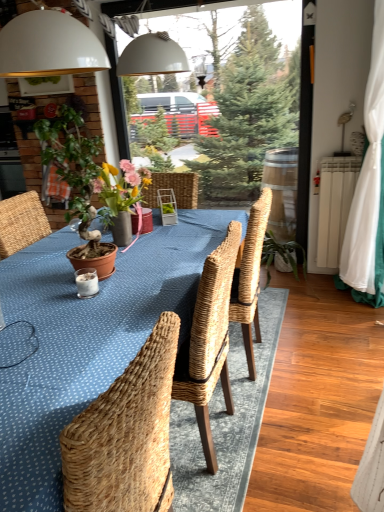
Question: Considering the relative sizes of terracotta pot at left and white fabric curtain at right in the image provided, is terracotta pot at left wider than white fabric curtain at right?

Choices:
 (A) yes
 (B) no

Answer: (A)

Question: Would you say terracotta pot at left is outside white fabric curtain at right?

Choices:
 (A) yes
 (B) no

Answer: (A)

Question: Can you confirm if terracotta pot at left is shorter than white fabric curtain at right?

Choices:
 (A) yes
 (B) no

Answer: (A)

Question: From a real-world perspective, is terracotta pot at left physically above white fabric curtain at right?

Choices:
 (A) no
 (B) yes

Answer: (B)

Question: Considering the relative positions of terracotta pot at left and white fabric curtain at right in the image provided, is terracotta pot at left to the right of white fabric curtain at right from the viewer's perspective?

Choices:
 (A) yes
 (B) no

Answer: (B)

Question: From a real-world perspective, is white fabric curtain at right above or below terracotta pot at left?

Choices:
 (A) below
 (B) above

Answer: (A)

Question: Is white fabric curtain at right bigger or smaller than terracotta pot at left?

Choices:
 (A) small
 (B) big

Answer: (B)

Question: Looking at their shapes, would you say white fabric curtain at right is wider or thinner than terracotta pot at left?

Choices:
 (A) wide
 (B) thin

Answer: (B)

Question: Is white fabric curtain at right inside or outside of terracotta pot at left?

Choices:
 (A) inside
 (B) outside

Answer: (B)

Question: Is blue woven table at center in front of or behind terracotta pot at left in the image?

Choices:
 (A) behind
 (B) front

Answer: (B)

Question: Based on their positions, is blue woven table at center located to the left or right of terracotta pot at left?

Choices:
 (A) right
 (B) left

Answer: (A)

Question: From the image's perspective, is blue woven table at center located above or below terracotta pot at left?

Choices:
 (A) below
 (B) above

Answer: (A)

Question: Would you say blue woven table at center is inside or outside terracotta pot at left?

Choices:
 (A) inside
 (B) outside

Answer: (B)

Question: From a real-world perspective, is white fabric curtain at right above or below blue woven table at center?

Choices:
 (A) below
 (B) above

Answer: (B)

Question: Considering the positions of white fabric curtain at right and blue woven table at center in the image, is white fabric curtain at right taller or shorter than blue woven table at center?

Choices:
 (A) short
 (B) tall

Answer: (B)